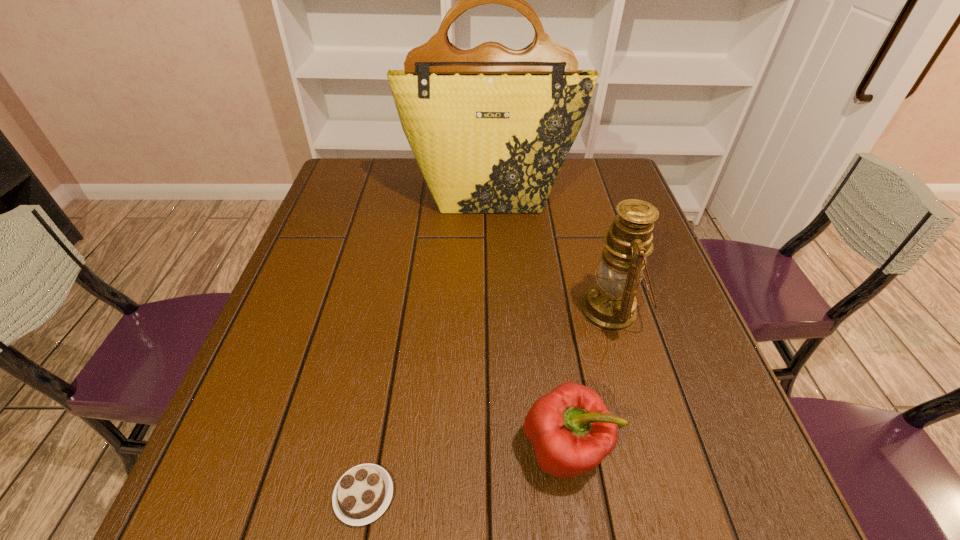
Where is `the tallest object`? the tallest object is located at coordinates (490, 127).

At what (x,y) coordinates should I click in order to perform the action: click on tote bag. Please return your answer as a coordinate pair (x, y). This screenshot has width=960, height=540. Looking at the image, I should click on (490, 127).

Identify the location of the second tallest object. (610, 305).

The height and width of the screenshot is (540, 960). Identify the location of oil lamp. (610, 305).

Find the location of `bell pepper`. bell pepper is located at coordinates (572, 431).

At what (x,y) coordinates should I click in order to perform the action: click on chocolate cake. Please return your answer as a coordinate pair (x, y). The height and width of the screenshot is (540, 960). Looking at the image, I should click on (363, 493).

At what (x,y) coordinates should I click in order to perform the action: click on free spot located on the front-facing side of the tote bag. Please return your answer as a coordinate pair (x, y). This screenshot has width=960, height=540. Looking at the image, I should click on (493, 288).

Find the location of a particular element. The height and width of the screenshot is (540, 960). vacant space located on the back of the second tallest object is located at coordinates (595, 254).

Find the location of a particular element. free space located 0.330m on the left of the bell pepper is located at coordinates (327, 449).

At what (x,y) coordinates should I click in order to perform the action: click on free region located on the back of the chocolate cake. Please return your answer as a coordinate pair (x, y). Image resolution: width=960 pixels, height=540 pixels. Looking at the image, I should click on point(398,301).